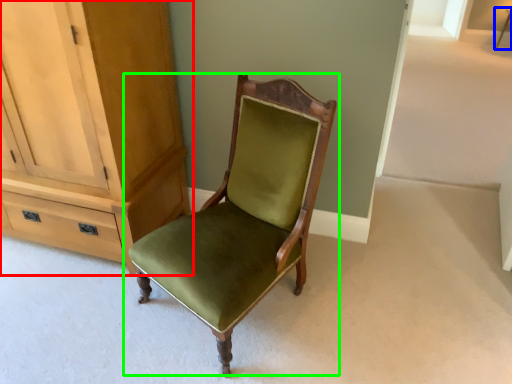
Question: Considering the real-world distances, which object is farthest from cabinetry (highlighted by a red box)? side table (highlighted by a blue box) or chair (highlighted by a green box)?

Choices:
 (A) side table
 (B) chair

Answer: (A)